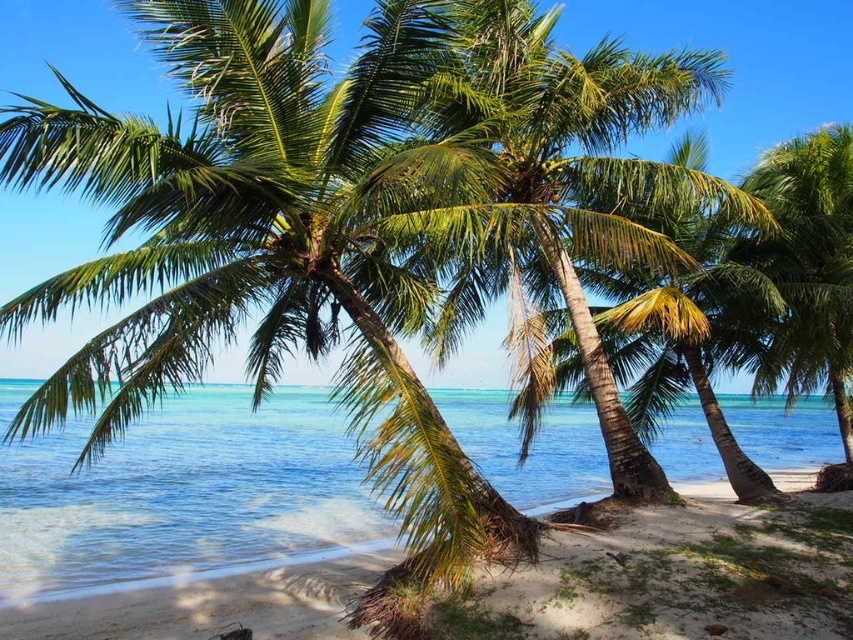
The height and width of the screenshot is (640, 853). What do you see at coordinates (184, 493) in the screenshot?
I see `clear blue water at center` at bounding box center [184, 493].

Between point (187, 540) and point (788, 141), which one is positioned behind?

The point (788, 141) is more distant.

Identify the location of clear blue water at center. The height and width of the screenshot is (640, 853). (184, 493).